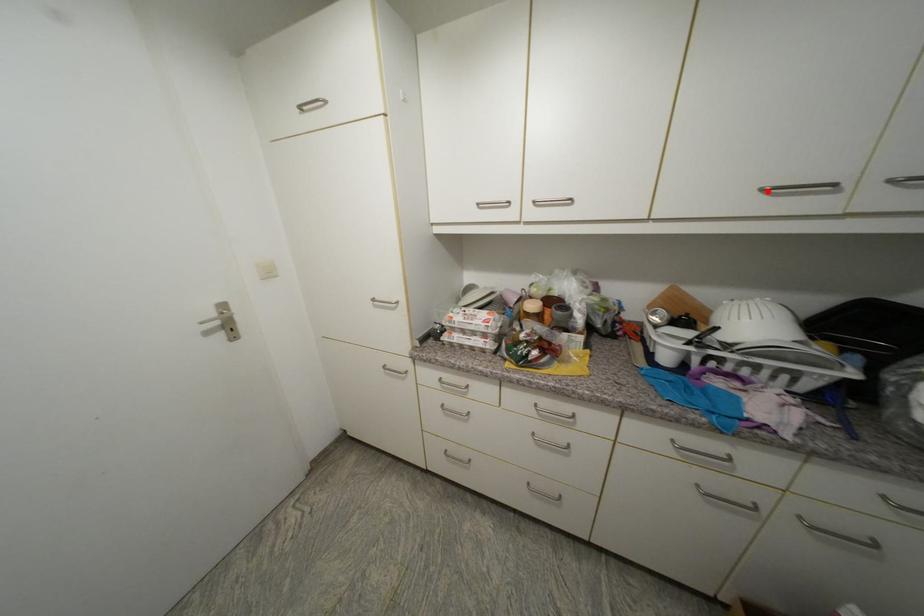
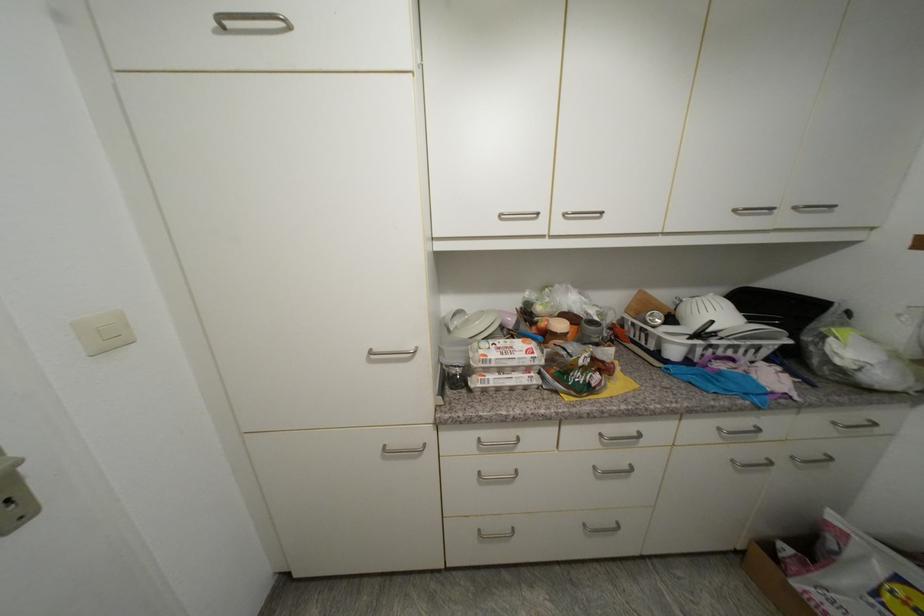
Locate, in the second image, the point that corresponds to the highlighted location in the first image.

(740, 213)